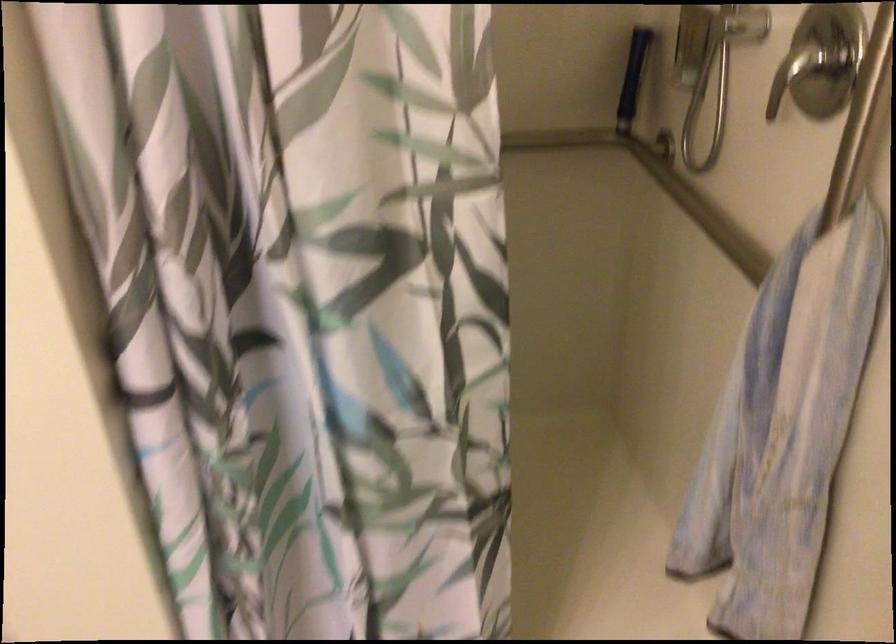
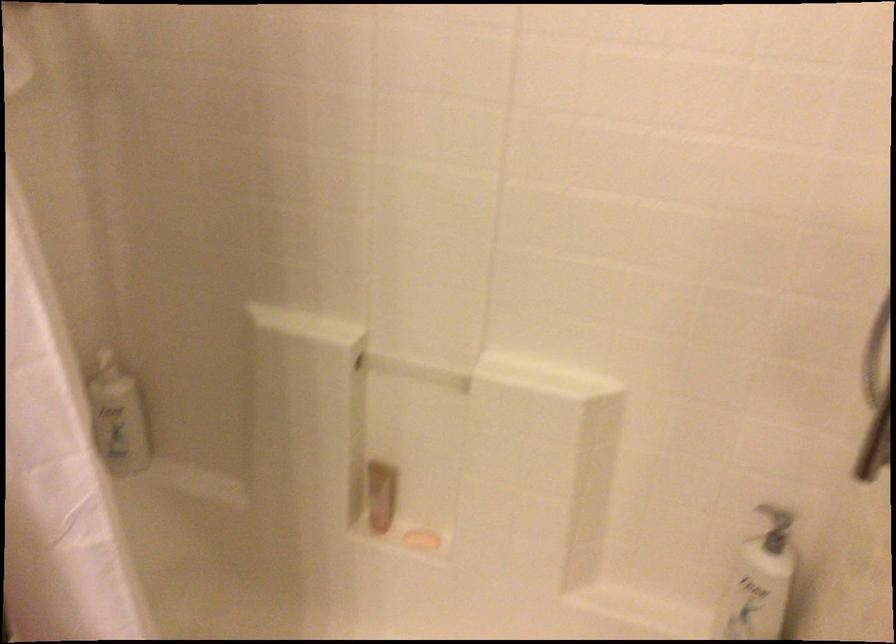
Question: The first image is from the beginning of the video and the second image is from the end. How did the camera likely rotate when shooting the video?

Choices:
 (A) Left
 (B) Right
 (C) Up
 (D) Down

Answer: (A)